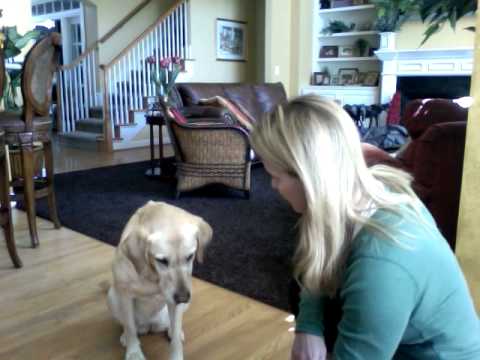
Locate an element on the screen. This screenshot has width=480, height=360. black rug is located at coordinates (95, 197).